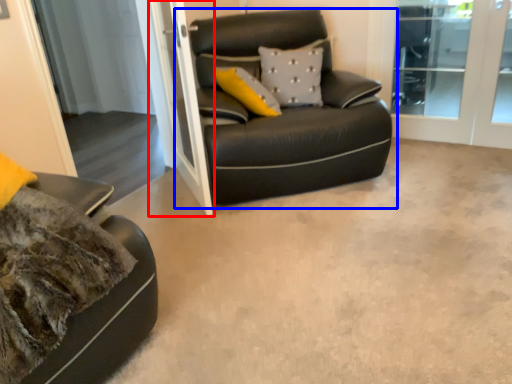
Question: Which object is closer to the camera taking this photo, screen door (highlighted by a red box) or studio couch (highlighted by a blue box)?

Choices:
 (A) screen door
 (B) studio couch

Answer: (A)